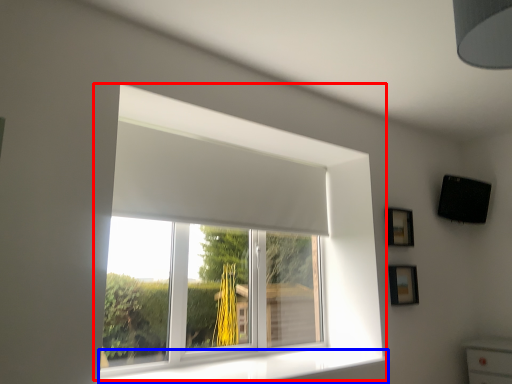
Question: Among these objects, which one is nearest to the camera, window (highlighted by a red box) or window sill (highlighted by a blue box)?

Choices:
 (A) window
 (B) window sill

Answer: (B)